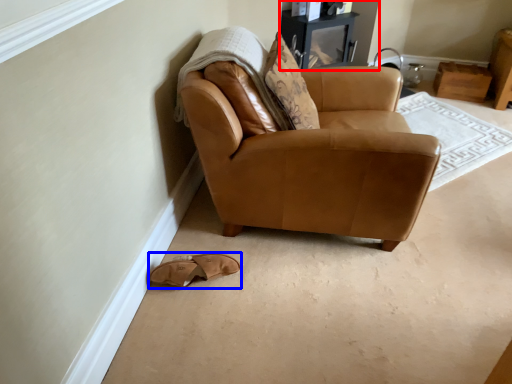
Question: Which of the following is the farthest to the observer, entertainment center (highlighted by a red box) or footwear (highlighted by a blue box)?

Choices:
 (A) entertainment center
 (B) footwear

Answer: (A)